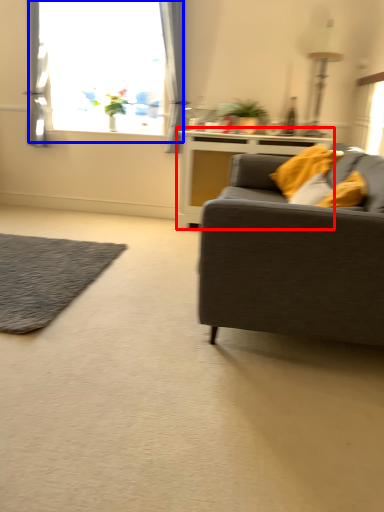
Question: Among these objects, which one is farthest to the camera, table (highlighted by a red box) or window (highlighted by a blue box)?

Choices:
 (A) table
 (B) window

Answer: (B)